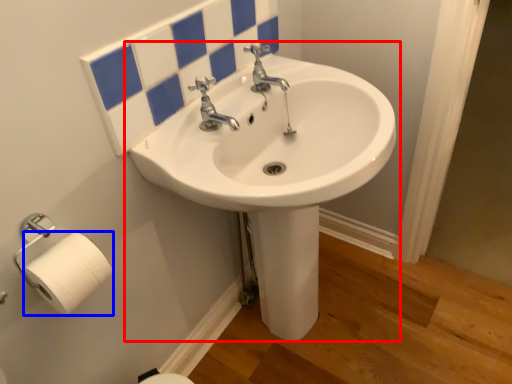
Question: Which point is further to the camera, sink (highlighted by a red box) or toilet paper (highlighted by a blue box)?

Choices:
 (A) sink
 (B) toilet paper

Answer: (B)